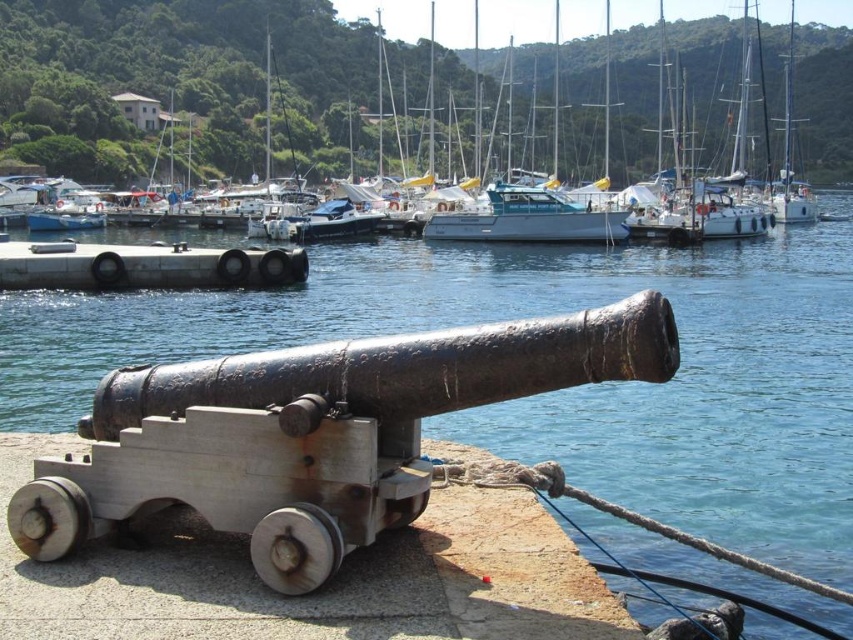
Between white plastic boat at upper center and rusty metal cannon at center, which one has more height?

white plastic boat at upper center

Based on the photo, measure the distance between white plastic boat at upper center and rusty metal cannon at center.

white plastic boat at upper center and rusty metal cannon at center are 115.59 meters apart.

Image resolution: width=853 pixels, height=640 pixels. Describe the element at coordinates (239, 92) in the screenshot. I see `white plastic boat at upper center` at that location.

Find the location of a particular element. This screenshot has height=640, width=853. white plastic boat at upper center is located at coordinates (239, 92).

Can you confirm if rusty metal cannon at center is positioned to the left of gray concrete dock at center?

Incorrect, rusty metal cannon at center is not on the left side of gray concrete dock at center.

Which of these two, rusty metal cannon at center or gray concrete dock at center, stands taller?

Standing taller between the two is gray concrete dock at center.

Where is `rusty metal cannon at center`? rusty metal cannon at center is located at coordinates tap(314, 433).

Who is higher up, white plastic boat at upper center or gray concrete dock at center?

Positioned higher is white plastic boat at upper center.

Who is more distant from viewer, (599, 108) or (231, 284)?

The point (599, 108) is more distant.

Locate an element on the screen. This screenshot has width=853, height=640. white plastic boat at upper center is located at coordinates (239, 92).

This screenshot has width=853, height=640. I want to click on white plastic boat at upper center, so click(x=239, y=92).